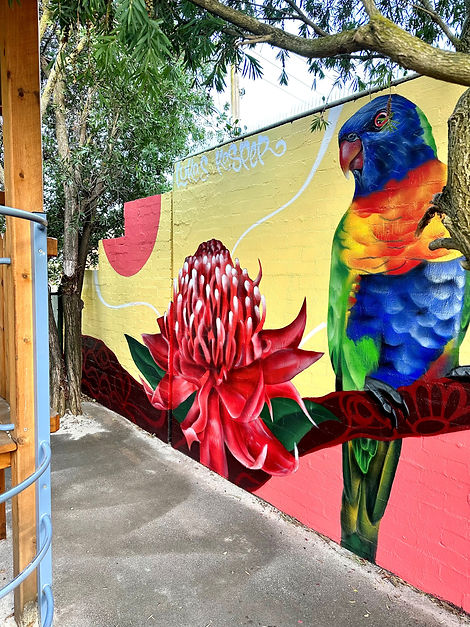
Find the location of a particular element. The height and width of the screenshot is (627, 470). mural painting of red paint is located at coordinates (454, 510).